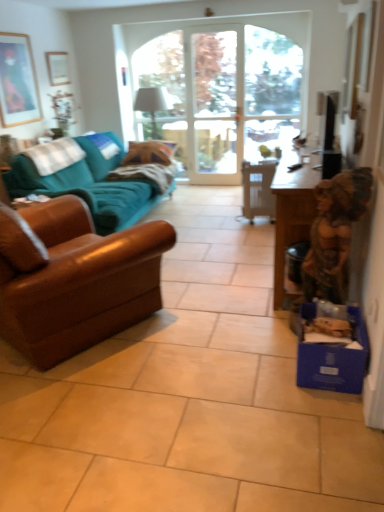
Identify the location of vacant area that is in front of brown leather couch at left, the first studio couch in the front-to-back sequence. (113, 425).